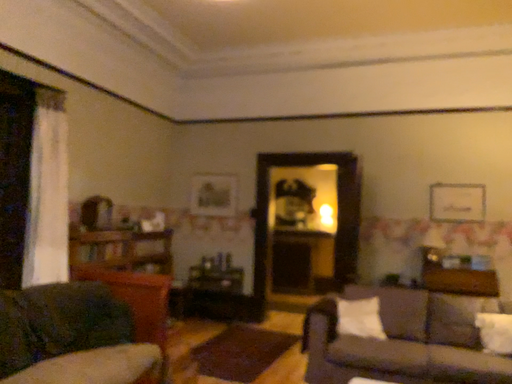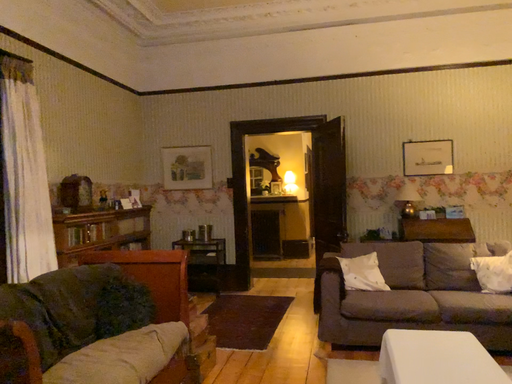
Question: How did the camera likely rotate when shooting the video?

Choices:
 (A) rotated left
 (B) rotated right

Answer: (B)